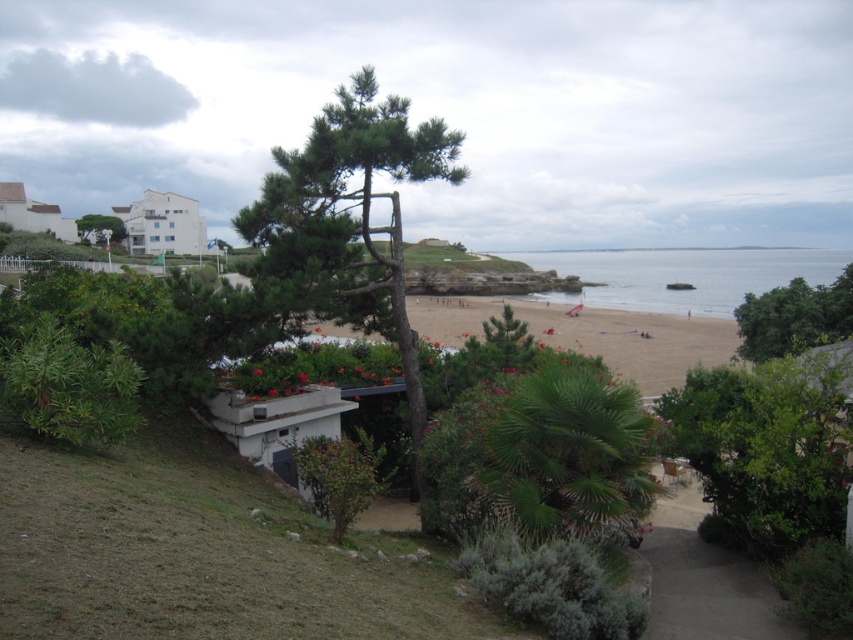
Which of these two, brown sandy beach at center or green leafy tree at lower right, stands taller?

Standing taller between the two is brown sandy beach at center.

Can you confirm if brown sandy beach at center is positioned to the left of green leafy tree at lower right?

Yes, brown sandy beach at center is to the left of green leafy tree at lower right.

Where is `brown sandy beach at center`? The height and width of the screenshot is (640, 853). brown sandy beach at center is located at coordinates (635, 340).

Which is behind, point (851, 294) or point (120, 220)?

Point (120, 220)

Which is above, green leafy tree at lower right or green leafy tree at center?

green leafy tree at center is above.

Where is `green leafy tree at lower right`? Image resolution: width=853 pixels, height=640 pixels. green leafy tree at lower right is located at coordinates (793, 317).

You are a GUI agent. You are given a task and a screenshot of the screen. Output one action in this format:
    pyautogui.click(x=<x>, y=<y>)
    Task: Click on the green leafy tree at lower right
    This screenshot has height=640, width=853.
    Given the screenshot: What is the action you would take?
    pyautogui.click(x=793, y=317)

Can you confirm if green textured tree at center is positioned to the left of clear blue water at center?

Yes, green textured tree at center is to the left of clear blue water at center.

Does green textured tree at center appear on the right side of clear blue water at center?

No, green textured tree at center is not to the right of clear blue water at center.

Does point (279, 220) come closer to viewer compared to point (601, 273)?

Yes, point (279, 220) is in front of point (601, 273).

Locate an element on the screen. The image size is (853, 640). green textured tree at center is located at coordinates (349, 218).